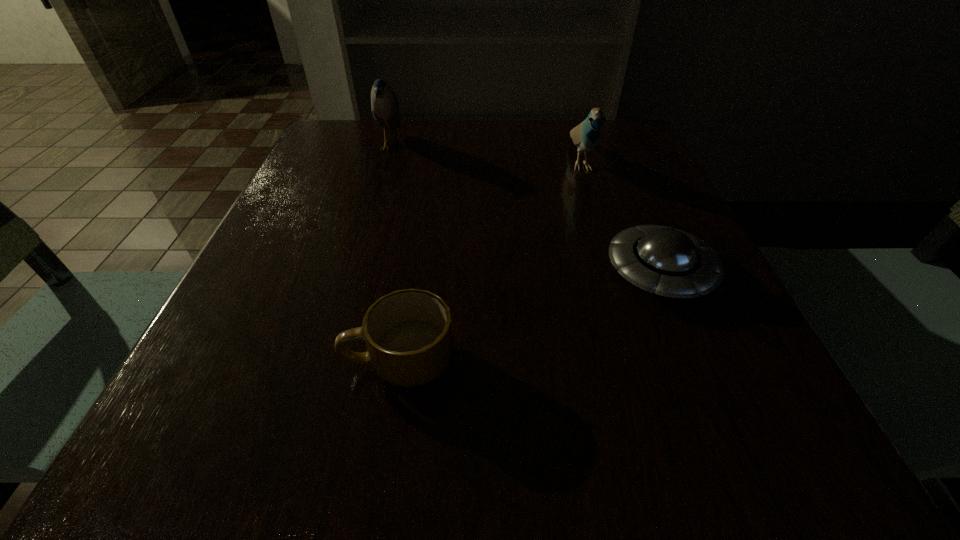
Image resolution: width=960 pixels, height=540 pixels. What are the coordinates of `vacant region located on the left of the saucer` in the screenshot? It's located at (444, 272).

Identify the location of object located in the left edge section of the desktop. This screenshot has width=960, height=540. (384, 105).

This screenshot has width=960, height=540. In order to click on bird at the right edge in this screenshot , I will do `click(586, 135)`.

Identify the location of saucer present at the right edge. This screenshot has width=960, height=540. (672, 263).

At what (x,y) coordinates should I click in order to perform the action: click on object that is at the far left corner. Please return your answer as a coordinate pair (x, y). Looking at the image, I should click on (384, 105).

Identify the location of object that is at the far right corner. (586, 135).

I want to click on vacant point at the far edge, so click(520, 163).

Where is `free point at the near edge`? This screenshot has height=540, width=960. free point at the near edge is located at coordinates (394, 471).

Find the location of a particular element. vacant space at the left edge of the desktop is located at coordinates (319, 177).

Find the location of a particular element. This screenshot has height=540, width=960. free space at the right edge is located at coordinates (640, 191).